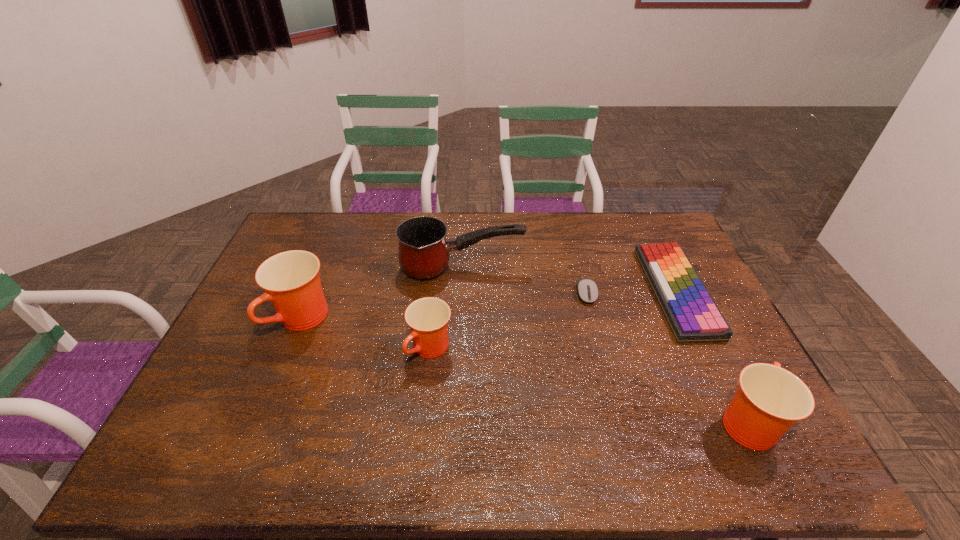
Where is `vacant area between the second shortest cup and the saucepan`? The height and width of the screenshot is (540, 960). vacant area between the second shortest cup and the saucepan is located at coordinates (604, 345).

You are a GUI agent. You are given a task and a screenshot of the screen. Output one action in this format:
    pyautogui.click(x=<x>, y=<y>)
    Task: Click on the free space between the leftmost cup and the computer keyboard
    The image size is (960, 540).
    Given the screenshot: What is the action you would take?
    pyautogui.click(x=490, y=306)

In order to click on empty space that is in between the saucepan and the computer equipment in this screenshot , I will do `click(524, 281)`.

The width and height of the screenshot is (960, 540). I want to click on free area in between the second shortest cup and the saucepan, so click(x=604, y=345).

This screenshot has width=960, height=540. I want to click on vacant area that lies between the second shortest cup and the saucepan, so click(604, 345).

Identify the location of free space that is in between the third object from right to left and the saucepan. coord(524,281).

Identify the location of the closest object to the saucepan. (587, 289).

Locate an element on the screen. Image resolution: width=960 pixels, height=540 pixels. the second closest object relative to the fourth tallest object is located at coordinates (291, 280).

Find the location of a particular element. The width and height of the screenshot is (960, 540). cup that is the closest one to the nearest cup is located at coordinates pos(428,317).

This screenshot has width=960, height=540. In order to click on cup that stands as the second closest to the third shortest object in this screenshot , I will do `click(769, 400)`.